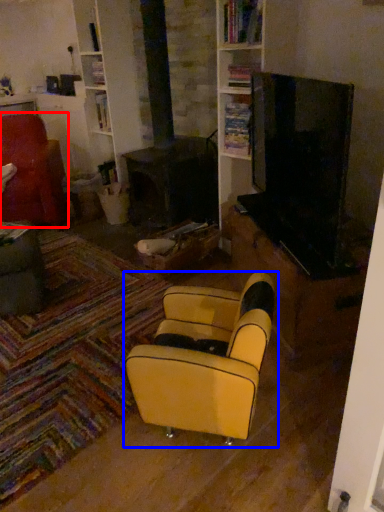
Question: Which of the following is the closest to the observer, chair (highlighted by a red box) or chair (highlighted by a blue box)?

Choices:
 (A) chair
 (B) chair

Answer: (B)